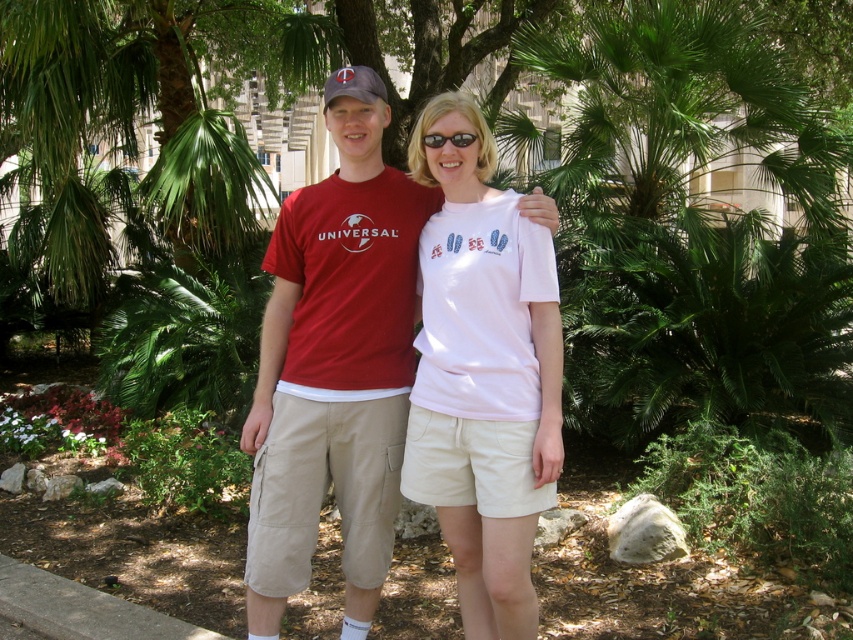
Question: Estimate the real-world distances between objects in this image. Which object is farther from the black plastic sunglasses at center?

Choices:
 (A) matte red t-shirt at center
 (B) white matte t-shirt at center

Answer: (A)

Question: Is matte red t-shirt at center wider than black plastic sunglasses at center?

Choices:
 (A) yes
 (B) no

Answer: (A)

Question: Does white matte t-shirt at center have a lesser width compared to black plastic sunglasses at center?

Choices:
 (A) yes
 (B) no

Answer: (B)

Question: Can you confirm if matte red t-shirt at center is positioned above matte brown baseball cap at upper center?

Choices:
 (A) yes
 (B) no

Answer: (B)

Question: Which of the following is the closest to the observer?

Choices:
 (A) (430, 138)
 (B) (485, 576)

Answer: (B)

Question: Which of the following is the farthest from the observer?

Choices:
 (A) (369, 68)
 (B) (473, 138)

Answer: (A)